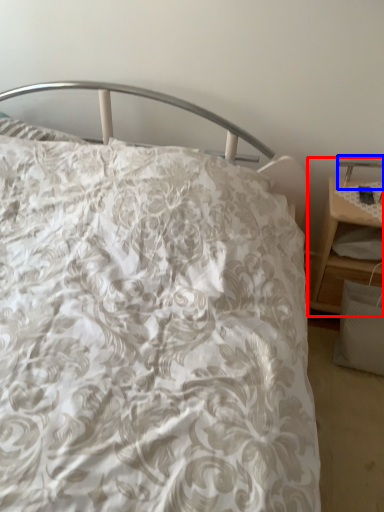
Question: Which of the following is the closest to the observer, nightstand (highlighted by a red box) or table lamp (highlighted by a blue box)?

Choices:
 (A) nightstand
 (B) table lamp

Answer: (A)